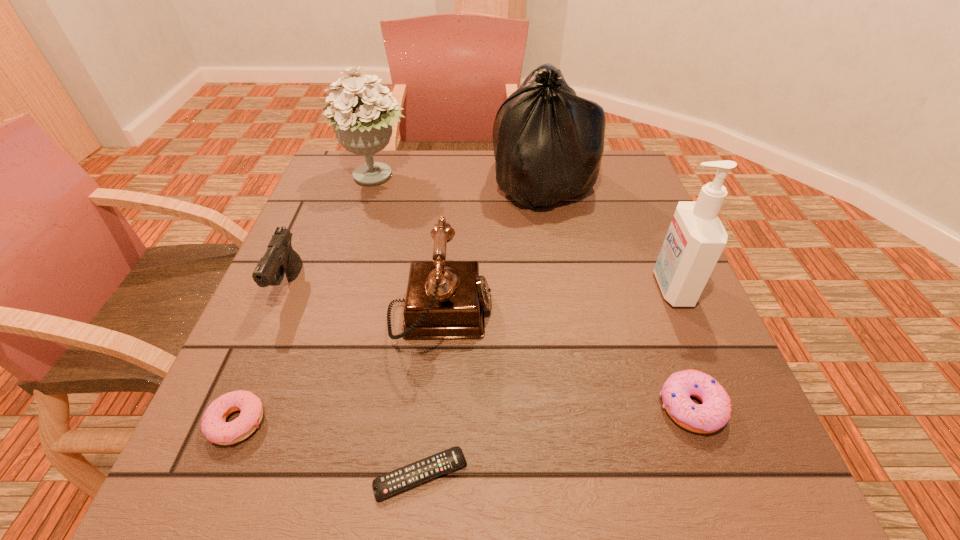
Locate an element on the screen. object located at the far left corner is located at coordinates click(x=363, y=122).

Identify the location of object that is at the near left corner. This screenshot has height=540, width=960. (215, 428).

This screenshot has height=540, width=960. Find the location of `object that is positioned at the far right corner`. object that is positioned at the far right corner is located at coordinates (548, 142).

Image resolution: width=960 pixels, height=540 pixels. In the image, there is a desktop. Identify the location of free region at the near edge. (296, 479).

What are the coordinates of `free space at the left edge` in the screenshot? It's located at (346, 287).

The image size is (960, 540). In the image, there is a desktop. Identify the location of vacant space at the right edge. (625, 253).

Find the location of a particular element. vacant space at the far left corner of the desktop is located at coordinates (374, 158).

Identify the location of vacant space at the near left corner. (238, 471).

In order to click on vacant space at the near right corner of the desktop in this screenshot , I will do `click(719, 498)`.

At what (x,y) coordinates should I click in order to perform the action: click on free space between the plastic bag and the pistol. Please return your answer as a coordinate pair (x, y). This screenshot has height=540, width=960. Looking at the image, I should click on (416, 234).